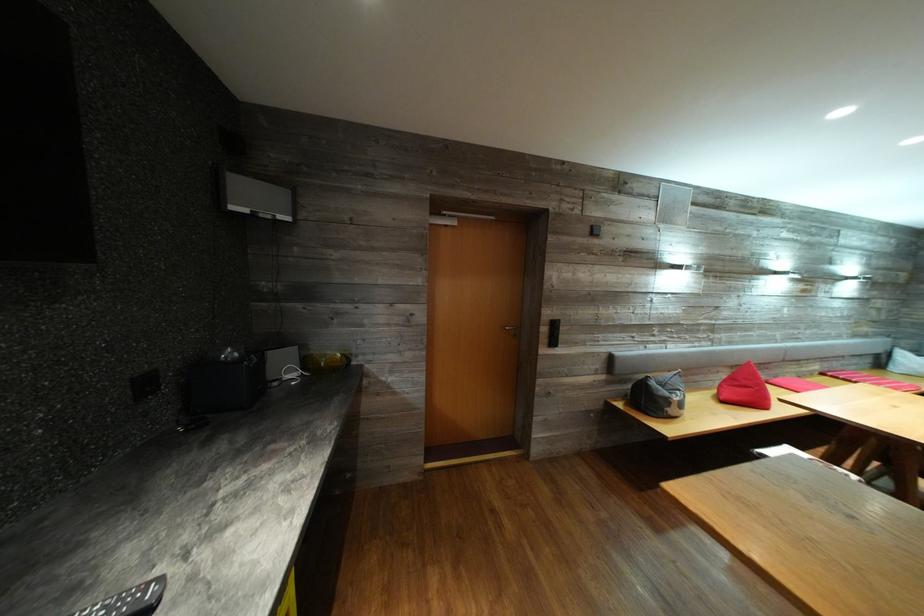
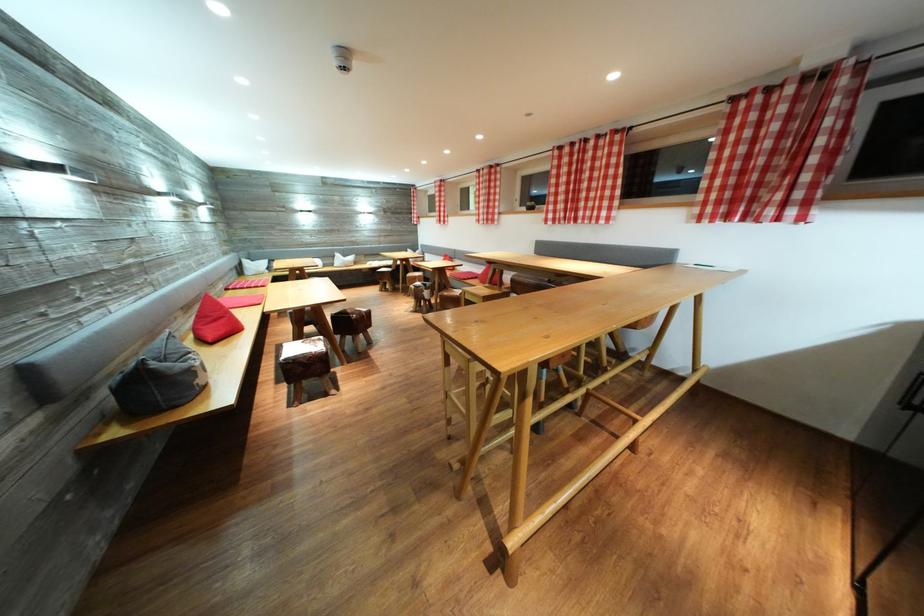
The point at (737,384) is marked in the first image. Where is the corresponding point in the second image?

(207, 323)